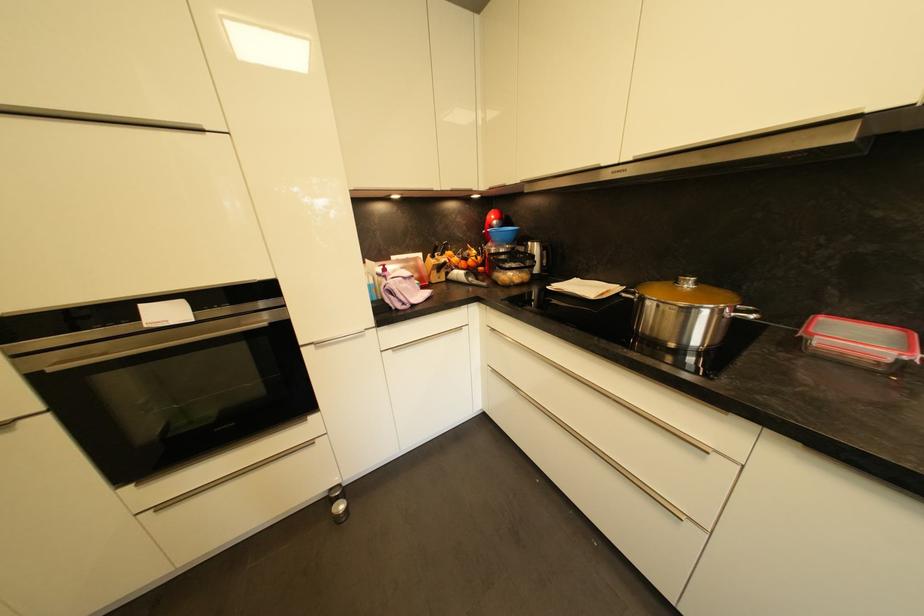
Locate an element on the screen. Image resolution: width=924 pixels, height=616 pixels. kettle handle is located at coordinates (628, 294).